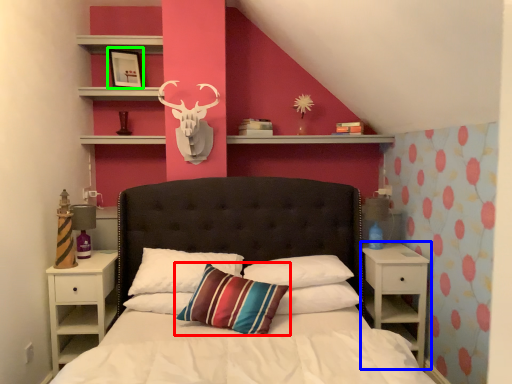
Question: Which object is positioned closest to pillow (highlighted by a red box)? Select from nightstand (highlighted by a blue box) and picture frame (highlighted by a green box).

Choices:
 (A) nightstand
 (B) picture frame

Answer: (A)